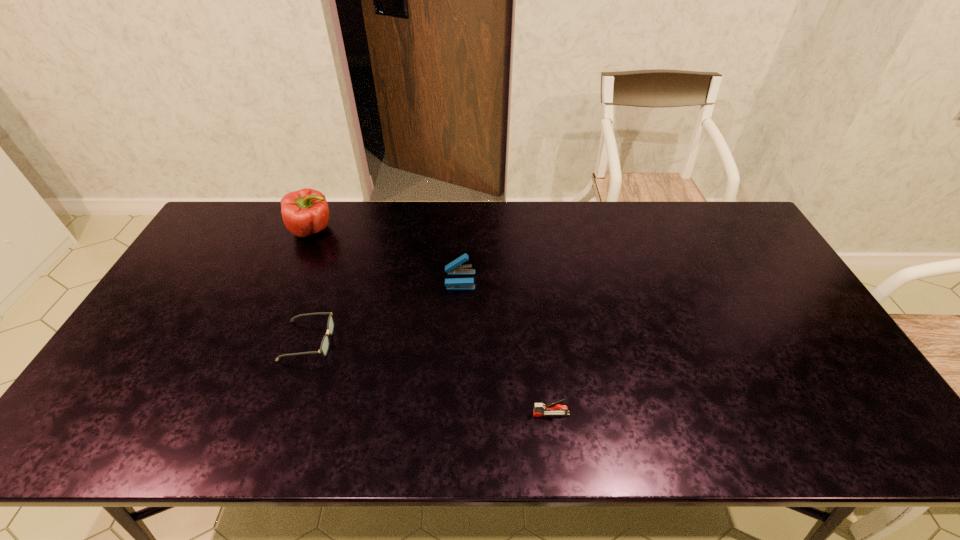
The height and width of the screenshot is (540, 960). I want to click on vacant space in between the spectacles and the third nearest object, so click(x=384, y=310).

Identify which object is the third nearest to the left stapler. Please provide its 2D coordinates. Your answer should be formatted as a tuple, i.e. [(x, y)], where the tuple contains the x and y coordinates of a point satisfying the conditions above.

[(550, 409)]

I want to click on object that is the second closest to the tallest object, so click(x=454, y=268).

I want to click on vacant space that satisfies the following two spatial constraints: 1. on the front side of the second farthest object; 2. on the face of the second nearest object, so click(x=457, y=341).

What are the coordinates of `vacant area that satisfies the following two spatial constraints: 1. on the front side of the second object from right to left; 2. on the face of the shortest object` in the screenshot? It's located at (457, 341).

Find the location of a particular element. vacant space that satisfies the following two spatial constraints: 1. on the front side of the third nearest object; 2. on the right side of the farthest object is located at coordinates (291, 280).

I want to click on free space in the image that satisfies the following two spatial constraints: 1. on the front side of the tallest object; 2. on the right side of the farther stapler, so click(291, 280).